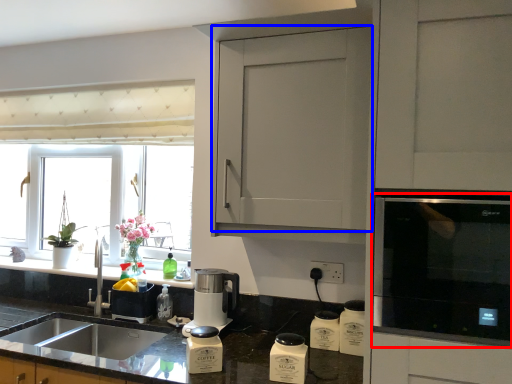
Question: Among these objects, which one is farthest to the camera, home appliance (highlighted by a red box) or cabinetry (highlighted by a blue box)?

Choices:
 (A) home appliance
 (B) cabinetry

Answer: (B)